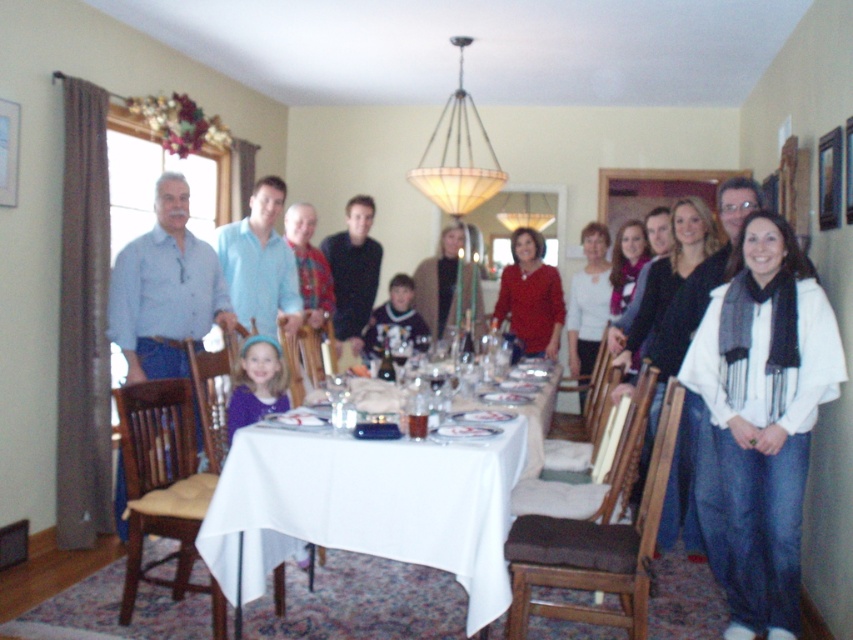
Question: Which of the following is the farthest from the observer?

Choices:
 (A) (463, 492)
 (B) (686, 374)
 (C) (167, 499)
 (D) (396, 305)

Answer: (D)

Question: Among these objects, which one is farthest from the camera?

Choices:
 (A) white scarf at center
 (B) dark blue shirt at center

Answer: (B)

Question: In this image, where is white cloth table at center located relative to matte red sweater at center?

Choices:
 (A) right
 (B) left

Answer: (B)

Question: Considering the relative positions of matte red sweater at center and knitted sweater at center in the image provided, where is matte red sweater at center located with respect to knitted sweater at center?

Choices:
 (A) below
 (B) above

Answer: (B)

Question: Which of the following is the farthest from the observer?

Choices:
 (A) white scarf at center
 (B) white cloth table at center

Answer: (A)

Question: Is matte red sweater at center bigger than knitted sweater at center?

Choices:
 (A) no
 (B) yes

Answer: (B)